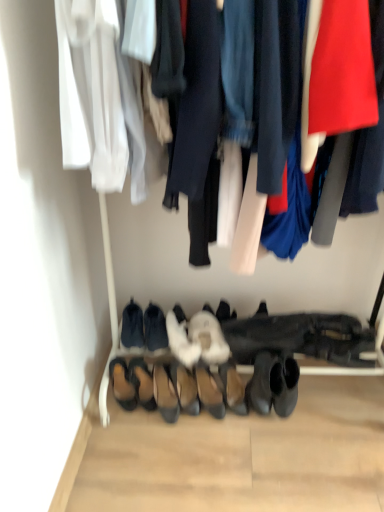
Question: Could you tell me if white fluffy slippers at center, which is the 6th footwear from left to right, is facing black suede shoes at lower center, the 2th footwear when ordered from left to right?

Choices:
 (A) no
 (B) yes

Answer: (A)

Question: Can you confirm if white fluffy slippers at center, which is the 6th footwear from left to right, is thinner than black suede shoes at lower center, the 2th footwear when ordered from left to right?

Choices:
 (A) no
 (B) yes

Answer: (A)

Question: Can you confirm if white fluffy slippers at center, which is the 6th footwear from left to right, is wider than black suede shoes at lower center, which appears as the 9th footwear when viewed from the right?

Choices:
 (A) no
 (B) yes

Answer: (B)

Question: From the image's perspective, is white fluffy slippers at center, which is the 6th footwear from left to right, below black suede shoes at lower center, which appears as the 9th footwear when viewed from the right?

Choices:
 (A) no
 (B) yes

Answer: (B)

Question: Is white fluffy slippers at center, which is the 6th footwear from left to right, next to black suede shoes at lower center, which appears as the 9th footwear when viewed from the right?

Choices:
 (A) yes
 (B) no

Answer: (B)

Question: In the image, is black suede shoes at lower center, the 2th footwear when ordered from left to right, on the left side or the right side of brown suede sandals at lower left, placed as the 1th footwear when sorted from left to right?

Choices:
 (A) right
 (B) left

Answer: (A)

Question: Is point (125, 311) closer or farther from the camera than point (112, 365)?

Choices:
 (A) farther
 (B) closer

Answer: (A)

Question: Considering their positions, is black suede shoes at lower center, which appears as the 9th footwear when viewed from the right, located in front of or behind brown suede sandals at lower left, placed as the 1th footwear when sorted from left to right?

Choices:
 (A) behind
 (B) front

Answer: (A)

Question: In terms of size, does black suede shoes at lower center, the 2th footwear when ordered from left to right, appear bigger or smaller than brown suede sandals at lower left, placed as the 1th footwear when sorted from left to right?

Choices:
 (A) small
 (B) big

Answer: (B)

Question: Is leather shoes at center, the eighth footwear viewed from the left, to the left or to the right of white fluffy slipper at center, which appears as the 2th footwear when viewed from the right, in the image?

Choices:
 (A) left
 (B) right

Answer: (A)

Question: From the image's perspective, is leather shoes at center, positioned as the 3th footwear in right-to-left order, positioned above or below white fluffy slipper at center, placed as the ninth footwear when sorted from left to right?

Choices:
 (A) below
 (B) above

Answer: (A)

Question: Is leather shoes at center, positioned as the 3th footwear in right-to-left order, wider or thinner than white fluffy slipper at center, which appears as the 2th footwear when viewed from the right?

Choices:
 (A) thin
 (B) wide

Answer: (A)

Question: Which is correct: leather shoes at center, positioned as the 3th footwear in right-to-left order, is inside white fluffy slipper at center, which appears as the 2th footwear when viewed from the right, or outside of it?

Choices:
 (A) outside
 (B) inside

Answer: (A)

Question: Based on their positions, is white fuzzy slippers at center, which ranks as the fourth footwear in right-to-left order, located to the left or right of white fluffy slippers at center, which is the 6th footwear from left to right?

Choices:
 (A) right
 (B) left

Answer: (A)

Question: Considering the positions of white fuzzy slippers at center, which ranks as the fourth footwear in right-to-left order, and white fluffy slippers at center, the fifth footwear from the right, in the image, is white fuzzy slippers at center, which ranks as the fourth footwear in right-to-left order, bigger or smaller than white fluffy slippers at center, the fifth footwear from the right,?

Choices:
 (A) small
 (B) big

Answer: (A)